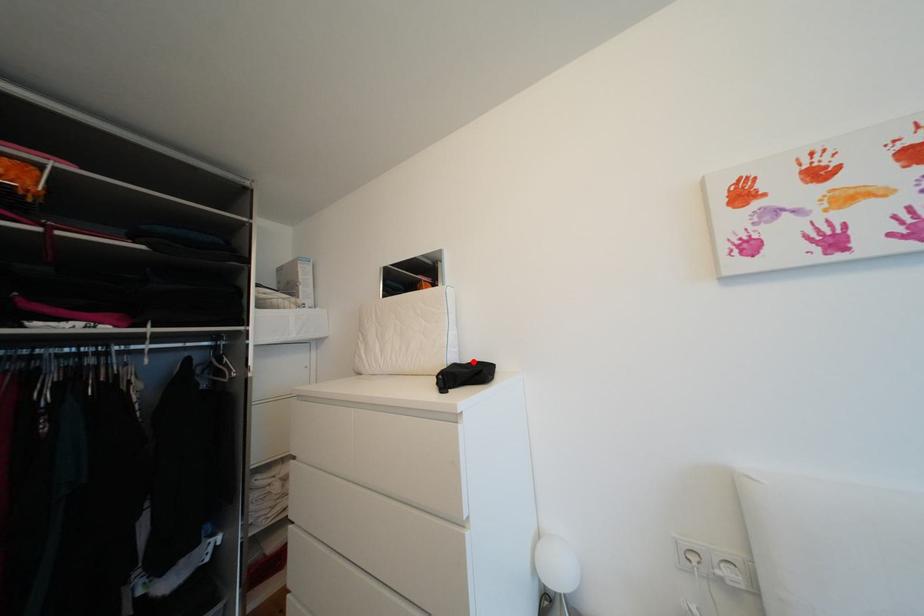
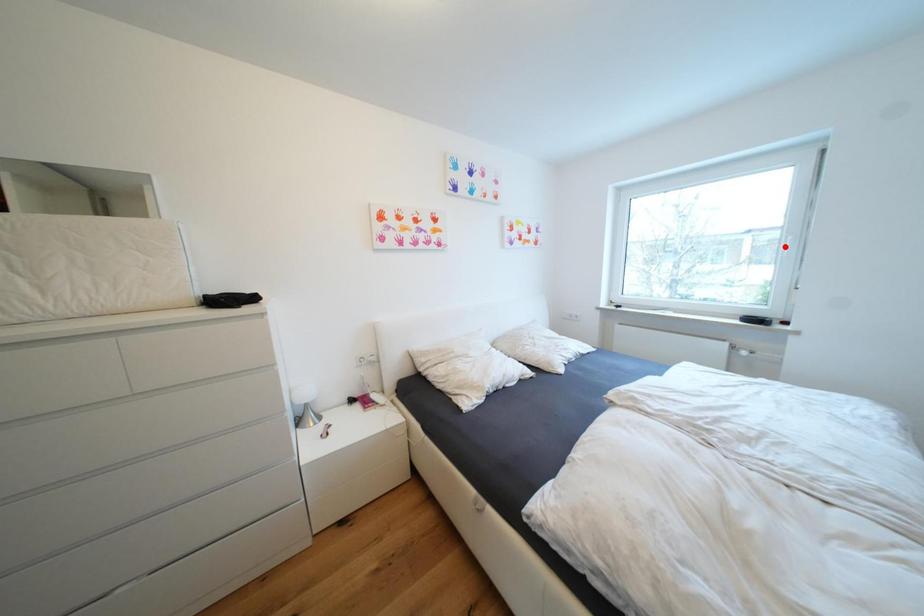
I am providing you with two images of the same scene from different viewpoints. A red point is marked on the first image and another point is marked on the second image. Does the point marked in image1 correspond to the same location as the one in image2?

No